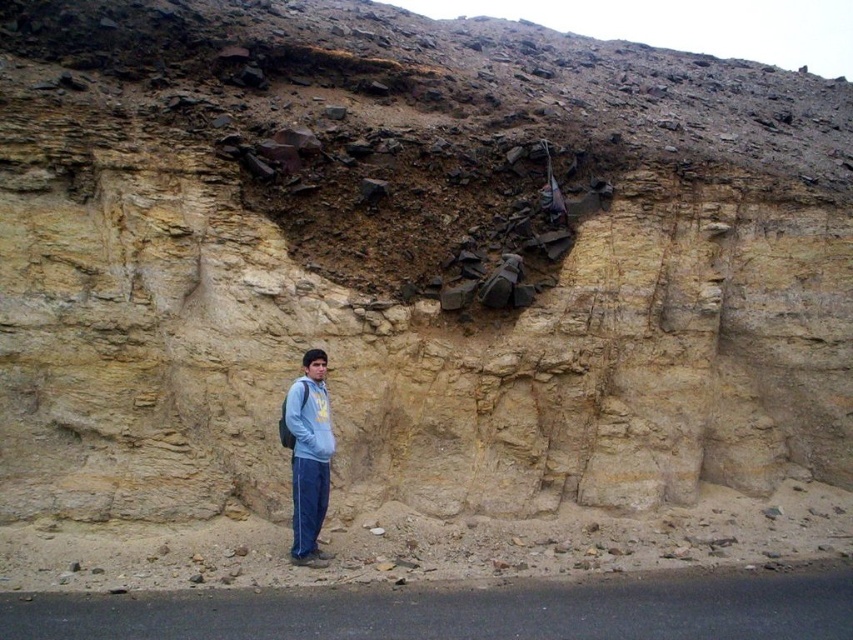
Does light blue denim pants at lower left have a lesser height compared to light blue fleece sweatshirt at lower center?

No.

Does light blue denim pants at lower left have a smaller size compared to light blue fleece sweatshirt at lower center?

Incorrect, light blue denim pants at lower left is not smaller in size than light blue fleece sweatshirt at lower center.

Does point (323, 422) come farther from viewer compared to point (329, 438)?

Yes.

The width and height of the screenshot is (853, 640). I want to click on light blue denim pants at lower left, so click(308, 456).